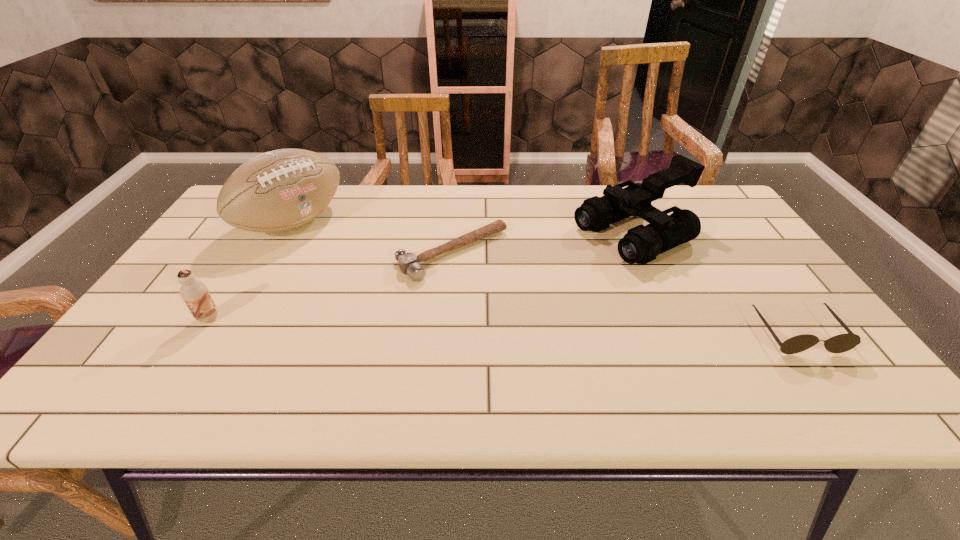
Locate an element on the screen. The height and width of the screenshot is (540, 960). free space between the fourth object from left to right and the rightmost object is located at coordinates (715, 284).

Where is `free spot between the shortest object and the sunglasses`? The width and height of the screenshot is (960, 540). free spot between the shortest object and the sunglasses is located at coordinates (625, 293).

The height and width of the screenshot is (540, 960). In order to click on free space between the chocolate milk and the football (American) in this screenshot , I will do `click(251, 271)`.

The height and width of the screenshot is (540, 960). In order to click on free space between the rightmost object and the football (American) in this screenshot , I will do [545, 278].

The image size is (960, 540). Identify the location of vacant area that lies between the hammer and the rightmost object. (625, 293).

This screenshot has width=960, height=540. I want to click on free space between the hammer and the rightmost object, so click(x=625, y=293).

Where is `free space that is in between the chocolate milk and the hammer`? The image size is (960, 540). free space that is in between the chocolate milk and the hammer is located at coordinates (331, 286).

You are a GUI agent. You are given a task and a screenshot of the screen. Output one action in this format:
    pyautogui.click(x=<x>, y=<y>)
    Task: Click on the free space that is in between the football (American) and the hammer
    The width and height of the screenshot is (960, 540).
    Given the screenshot: What is the action you would take?
    pyautogui.click(x=372, y=238)

Identify which object is located as the third nearest to the third tallest object. Please provide its 2D coordinates. Your answer should be formatted as a tuple, i.e. [(x, y)], where the tuple contains the x and y coordinates of a point satisfying the conditions above.

[(641, 244)]

Select which object is the second closest to the second tallest object. Please provide its 2D coordinates. Your answer should be formatted as a tuple, i.e. [(x, y)], where the tuple contains the x and y coordinates of a point satisfying the conditions above.

[(408, 263)]